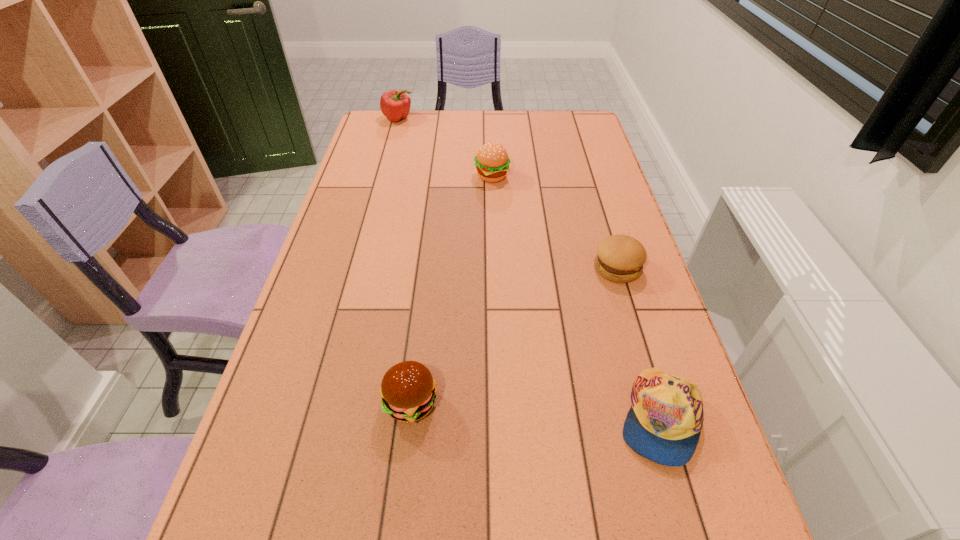
Where is `the farthest object`? The height and width of the screenshot is (540, 960). the farthest object is located at coordinates (395, 105).

Identify the location of bell pepper. (395, 105).

Image resolution: width=960 pixels, height=540 pixels. I want to click on the third object from left to right, so click(492, 162).

You are a GUI agent. You are given a task and a screenshot of the screen. Output one action in this format:
    pyautogui.click(x=<x>, y=<y>)
    Task: Click on the second farthest object
    Image resolution: width=960 pixels, height=540 pixels.
    Given the screenshot: What is the action you would take?
    (x=492, y=162)

Locate an element on the screen. This screenshot has height=540, width=960. the leftmost hamburger is located at coordinates (408, 390).

Where is `the nearest hamburger`? The image size is (960, 540). the nearest hamburger is located at coordinates (408, 390).

Where is `cap`? This screenshot has height=540, width=960. cap is located at coordinates (664, 423).

This screenshot has height=540, width=960. What are the coordinates of `the rightmost hamburger` in the screenshot? It's located at (620, 258).

Locate an element on the screen. This screenshot has width=960, height=540. the second nearest hamburger is located at coordinates (620, 258).

You are a GUI agent. You are given a task and a screenshot of the screen. Output one action in this format:
    pyautogui.click(x=<x>, y=<y>)
    Task: Click on the blank space located 0.100m on the right of the leftmost object
    The height and width of the screenshot is (540, 960).
    Given the screenshot: What is the action you would take?
    pyautogui.click(x=440, y=119)